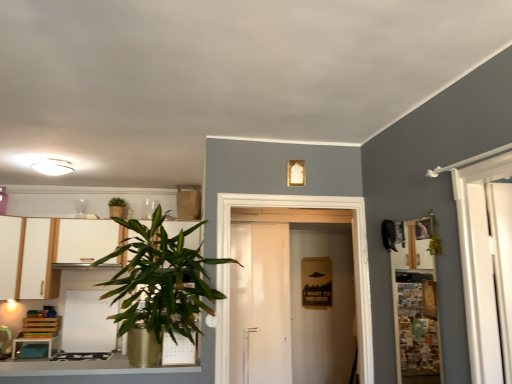
Question: In terms of size, does wooden/matte shelf at right appear bigger or smaller than white matte cabinet at left, which appears as the first cabinetry when viewed from the right?

Choices:
 (A) big
 (B) small

Answer: (B)

Question: From the image's perspective, relative to white matte cabinet at left, the second cabinetry in the left-to-right sequence, is wooden/matte shelf at right above or below?

Choices:
 (A) below
 (B) above

Answer: (B)

Question: Which object is the closest to the green leafy plant at upper left, the 2th houseplant viewed from the right?

Choices:
 (A) wooden/matte shelf at right
 (B) white glossy cabinet at left
 (C) white glossy stove at lower left
 (D) white matte cabinet at left, which appears as the first cabinetry when viewed from the right
 (E) green leafy plant at left, the 1th houseplant viewed from the front

Answer: (E)

Question: Estimate the real-world distances between objects in this image. Which object is farther from the green leafy plant at upper left, arranged as the 2th houseplant when viewed from the front?

Choices:
 (A) white matte door at center
 (B) green leafy plant at left, which is counted as the second houseplant, starting from the back
 (C) white glossy cabinet at left
 (D) white matte cabinet at left, the second cabinetry in the left-to-right sequence
 (E) white matte cabinet at left, the 2th cabinetry in the right-to-left sequence

Answer: (E)